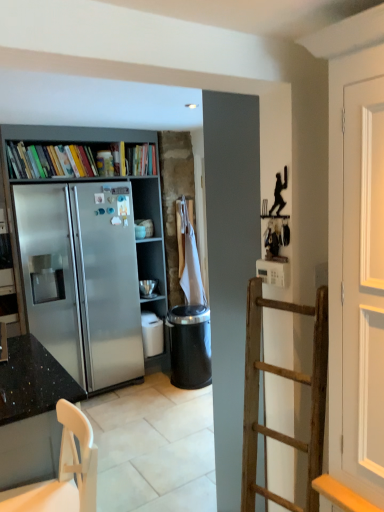
Question: Is satin silver bookcase at left with black plastic trash can at center?

Choices:
 (A) no
 (B) yes

Answer: (A)

Question: From a real-world perspective, is satin silver bookcase at left positioned under black plastic trash can at center based on gravity?

Choices:
 (A) no
 (B) yes

Answer: (A)

Question: Is satin silver bookcase at left far away from black plastic trash can at center?

Choices:
 (A) no
 (B) yes

Answer: (A)

Question: Is satin silver bookcase at left not inside black plastic trash can at center?

Choices:
 (A) yes
 (B) no

Answer: (A)

Question: Is satin silver bookcase at left taller than black plastic trash can at center?

Choices:
 (A) no
 (B) yes

Answer: (B)

Question: Do you think granite black countertop at left is within satin silver bookcase at left, or outside of it?

Choices:
 (A) outside
 (B) inside

Answer: (A)

Question: Is point coord(34,342) positioned closer to the camera than point coord(97,137)?

Choices:
 (A) closer
 (B) farther

Answer: (A)

Question: In the image, is granite black countertop at left on the left side or the right side of satin silver bookcase at left?

Choices:
 (A) right
 (B) left

Answer: (A)

Question: From a real-world perspective, is granite black countertop at left positioned above or below satin silver bookcase at left?

Choices:
 (A) below
 (B) above

Answer: (A)

Question: Is satin silver bookcase at left spatially inside granite black countertop at left, or outside of it?

Choices:
 (A) inside
 (B) outside

Answer: (B)

Question: In the image, is satin silver bookcase at left on the left side or the right side of granite black countertop at left?

Choices:
 (A) left
 (B) right

Answer: (A)

Question: In terms of height, does satin silver bookcase at left look taller or shorter compared to granite black countertop at left?

Choices:
 (A) short
 (B) tall

Answer: (B)

Question: Does point (23, 132) appear closer or farther from the camera than point (57, 436)?

Choices:
 (A) closer
 (B) farther

Answer: (B)

Question: Is granite black countertop at left taller or shorter than white plastic chair at lower left?

Choices:
 (A) short
 (B) tall

Answer: (B)

Question: Considering the positions of point (57, 428) and point (81, 446), is point (57, 428) closer or farther from the camera than point (81, 446)?

Choices:
 (A) farther
 (B) closer

Answer: (A)